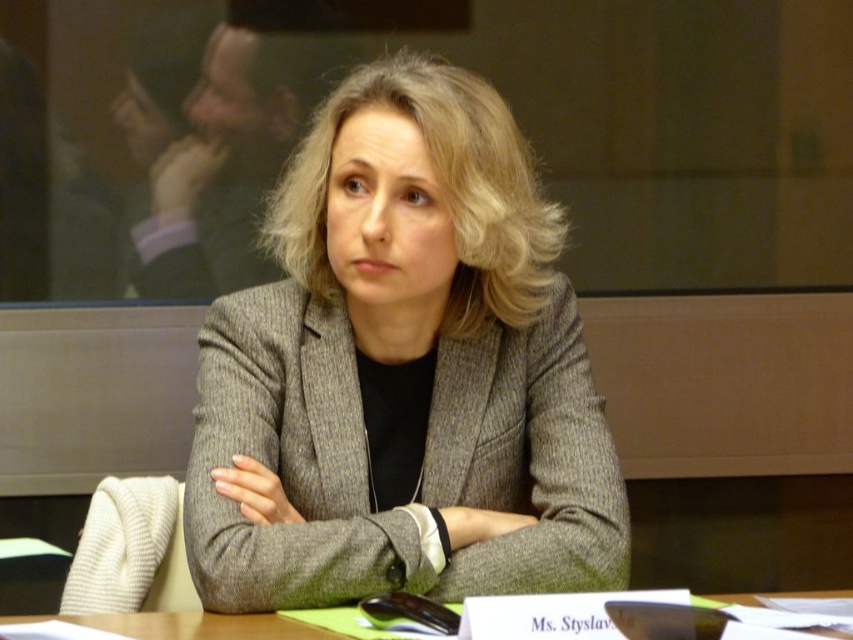
Can you confirm if gray textured blazer at center is positioned below green felt placemat at center?

No, gray textured blazer at center is not below green felt placemat at center.

Who is positioned more to the left, gray textured blazer at center or green felt placemat at center?

Positioned to the left is green felt placemat at center.

The image size is (853, 640). What are the coordinates of `gray textured blazer at center` in the screenshot? It's located at (403, 372).